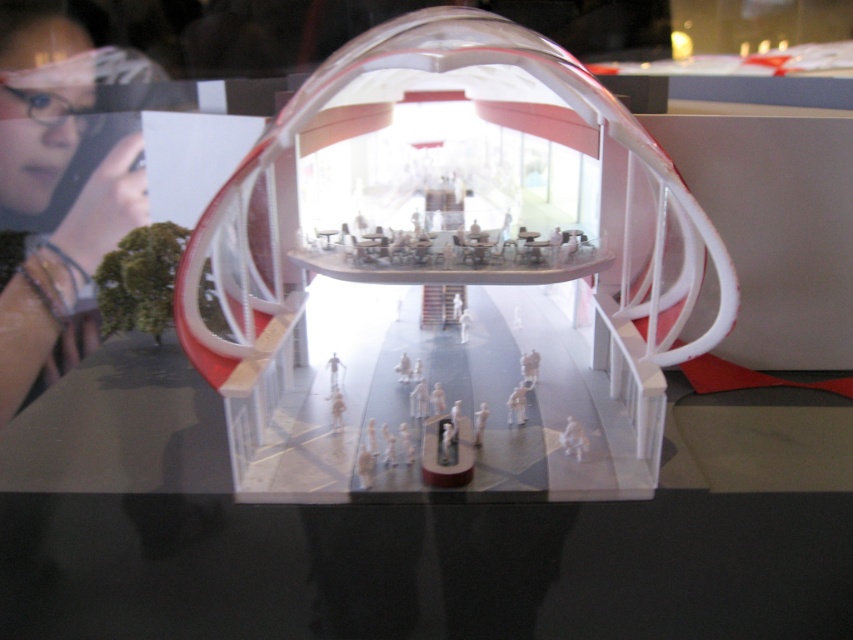
Measure the distance between transparent plastic glass box at center and camera.

They are 35.53 inches apart.

Who is more forward, [303,292] or [21,259]?

Point [303,292]

Which is behind, point (236, 436) or point (44, 358)?

The point (44, 358) is behind.

Image resolution: width=853 pixels, height=640 pixels. What are the coordinates of `transparent plastic glass box at center` in the screenshot? It's located at (450, 275).